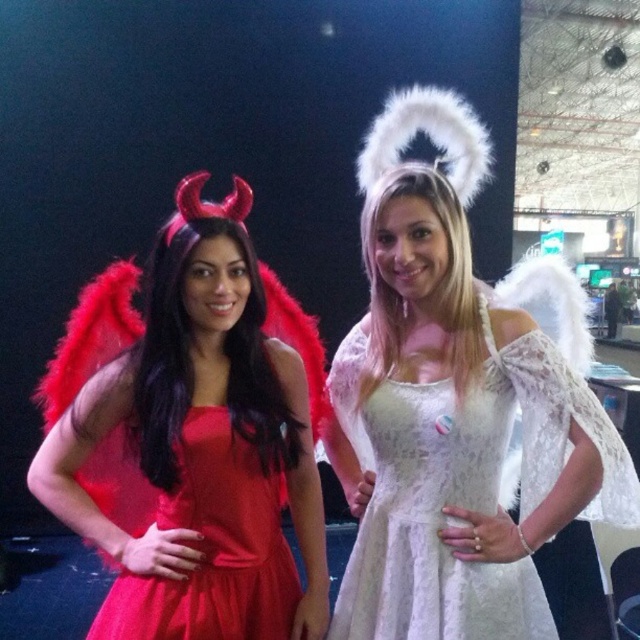
Based on the scene description, where is the lace white dress at center located in terms of its 2D coordinates?

The lace white dress at center is located at the 2D coordinates point (461,488).

You are at a costume party and need to decide which costume is on the left. You see two dresses at center, the lace white dress at center and the matte red dress at center. Which one is on the left?

The matte red dress at center is on the left because the lace white dress at center is positioned on the right side of it.